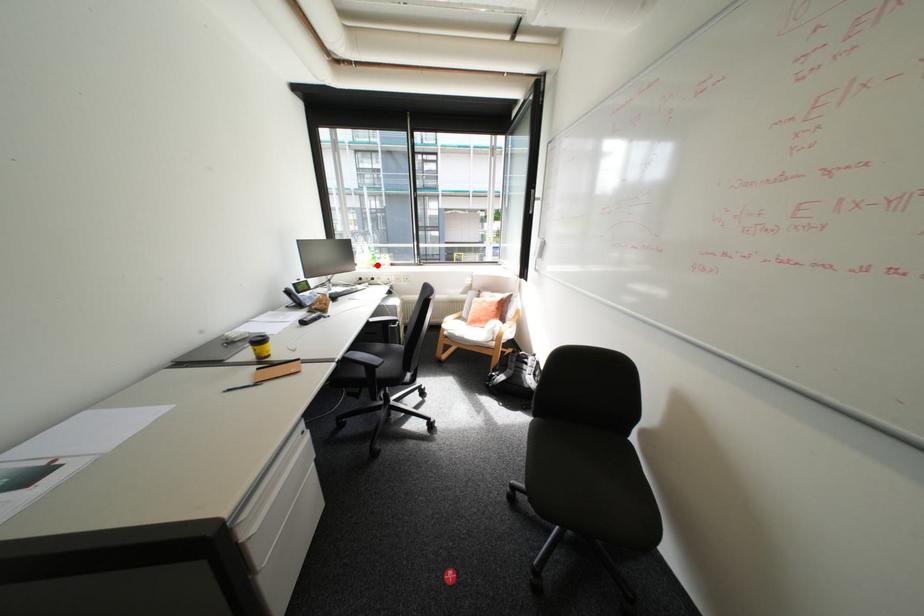
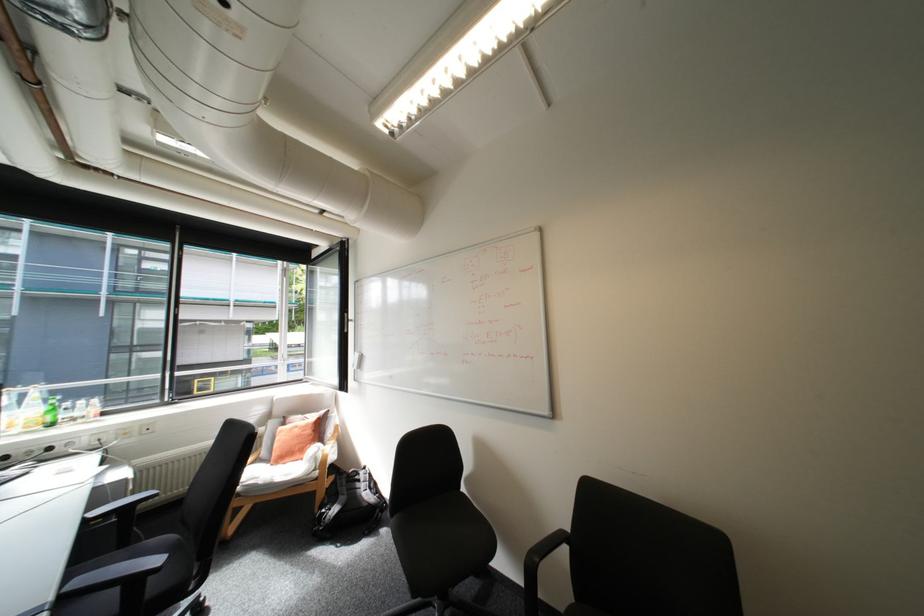
Question: I am providing you with two images of the same scene from different viewpoints. Given a red point in image1, look at the same physical point in image2. Is it:

Choices:
 (A) Closer to the viewpoint
 (B) Farther from the viewpoint

Answer: (B)